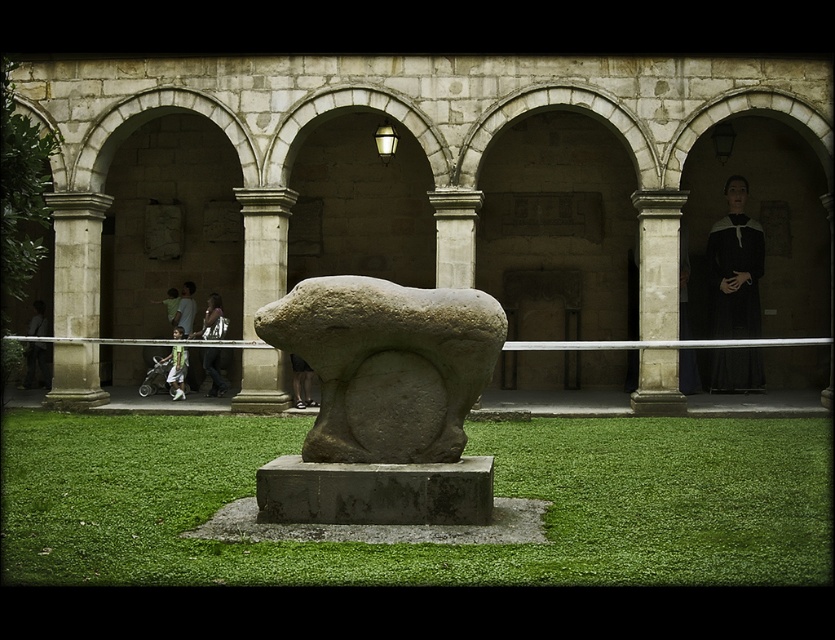
Question: Is gray stone pillar at center further to camera compared to green fabric stroller at center?

Choices:
 (A) yes
 (B) no

Answer: (B)

Question: Which object is the closest to the dark gray stone statue at center?

Choices:
 (A) smooth stone column at left
 (B) black woolen robe at right
 (C) gray stone bear at center

Answer: (A)

Question: Observing the image, what is the correct spatial positioning of stone column at right in reference to green fabric stroller at center?

Choices:
 (A) above
 (B) below

Answer: (A)

Question: Considering the real-world distances, which object is farthest from the green grass at center?

Choices:
 (A) stone column at right
 (B) green fabric pants at center
 (C) gray stone pillar at center
 (D) black woolen robe at right

Answer: (B)

Question: Which point is closer to the camera taking this photo?

Choices:
 (A) (219, 380)
 (B) (89, 353)

Answer: (B)

Question: Can you confirm if black woolen robe at right is positioned to the right of green fabric pants at center?

Choices:
 (A) no
 (B) yes

Answer: (B)